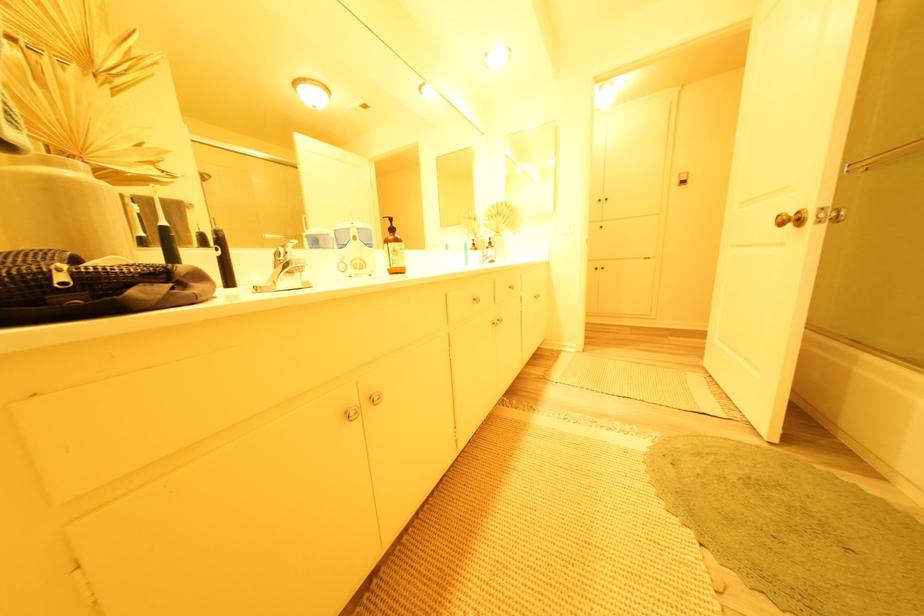
Locate an element on the screen. Image resolution: width=924 pixels, height=616 pixels. metal zipper pull is located at coordinates (351, 413).